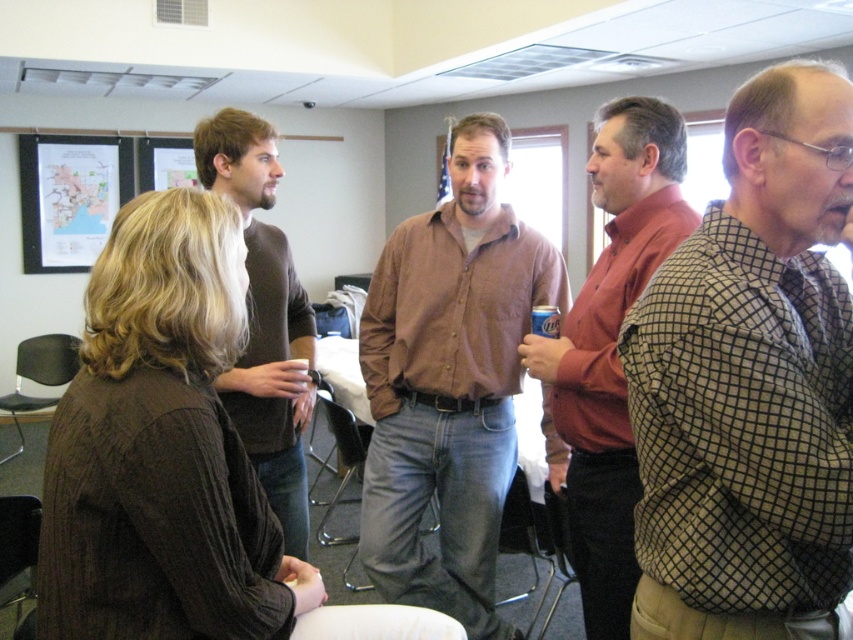
You are standing in the conference room and want to determine which of the two points, point (657, 602) or point (267, 493), is nearer to you. Based on the coordinates provided, which point is closer?

Point (657, 602) is closer to you than point (267, 493) because it is closer to the camera, as indicated by its coordinates.